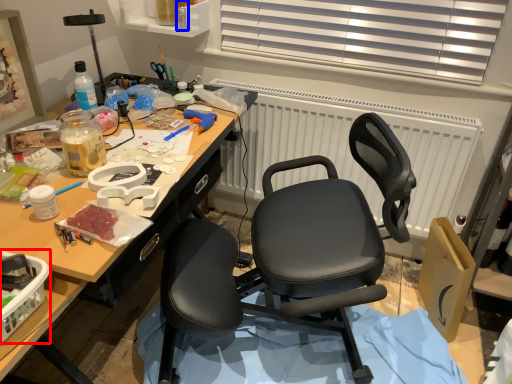
Question: Among these objects, which one is farthest to the camera, box (highlighted by a red box) or bottle (highlighted by a blue box)?

Choices:
 (A) box
 (B) bottle

Answer: (B)